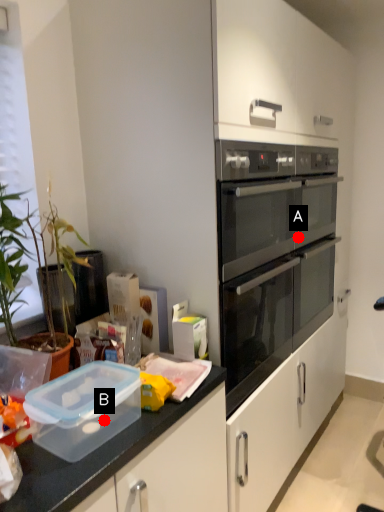
Question: Two points are circled on the image, labeled by A and B beside each circle. Among these points, which one is farthest from the camera?

Choices:
 (A) A is further
 (B) B is further

Answer: (A)